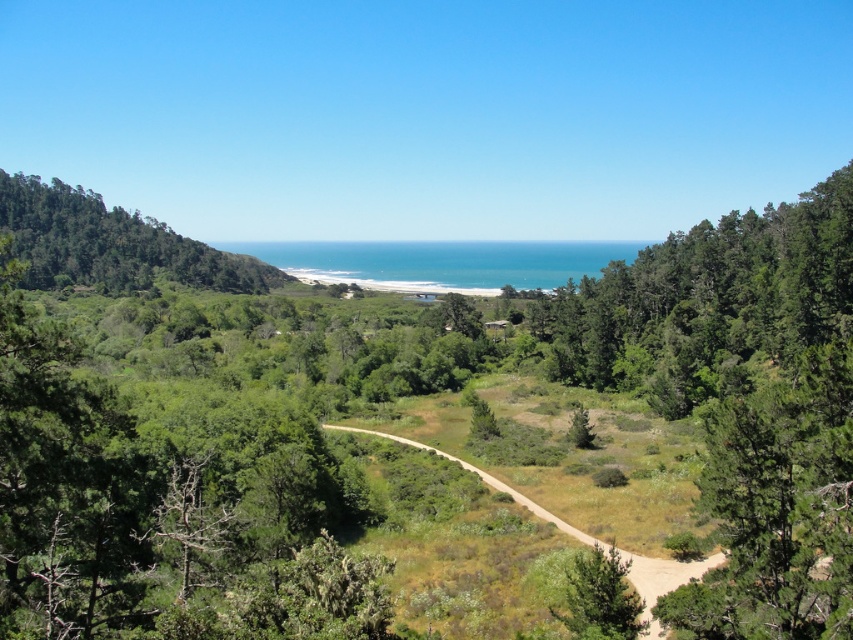
You are a hiker standing at the start of the trail and want to reach the beach. Which object do you need to pass first, the green leafy trees at left or the brown dirt path at center?

You need to pass the green leafy trees at left first because they are closer to you than the brown dirt path at center.

You are standing on the winding dirt path and want to reach the beach. You see a green leafy tree at center and a green matte tree at center. Which tree should you walk around to stay on the path towards the beach?

Since the green leafy tree at center is to the left of the green matte tree at center, you should walk around the green leafy tree at center to stay on the path towards the beach.